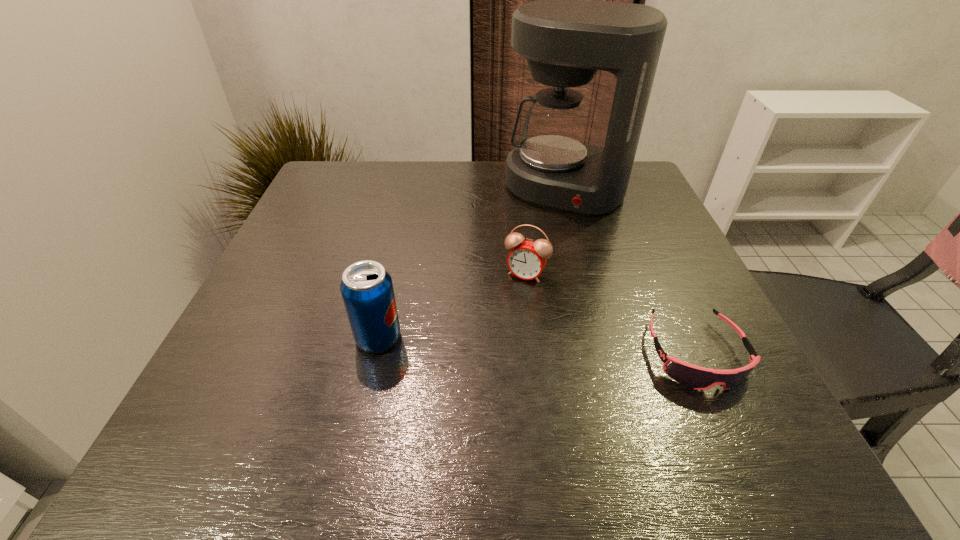
Find the location of a particular element. The image size is (960, 540). vacant area that satisfies the following two spatial constraints: 1. on the back side of the alarm clock; 2. on the right side of the tallest object is located at coordinates (516, 189).

Locate an element on the screen. free space that satisfies the following two spatial constraints: 1. on the back side of the pop soda; 2. on the right side of the alarm clock is located at coordinates (393, 274).